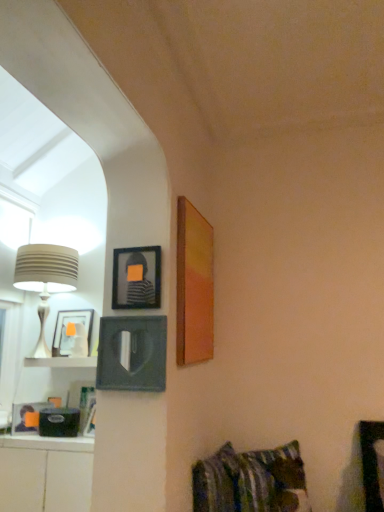
Question: From a real-world perspective, is matte wooden picture frame at upper right, which ranks as the 1th picture frame in right-to-left order, positioned over white glossy cabinet at lower left based on gravity?

Choices:
 (A) no
 (B) yes

Answer: (B)

Question: From a real-world perspective, is matte wooden picture frame at upper right, which is counted as the 3th picture frame, starting from the left, positioned under white glossy cabinet at lower left based on gravity?

Choices:
 (A) no
 (B) yes

Answer: (A)

Question: Does matte wooden picture frame at upper right, which is counted as the 3th picture frame, starting from the left, have a larger size compared to white glossy cabinet at lower left?

Choices:
 (A) no
 (B) yes

Answer: (A)

Question: Is matte wooden picture frame at upper right, which is counted as the 3th picture frame, starting from the left, thinner than white glossy cabinet at lower left?

Choices:
 (A) no
 (B) yes

Answer: (B)

Question: Is the position of matte wooden picture frame at upper right, which is counted as the 3th picture frame, starting from the left, more distant than that of white glossy cabinet at lower left?

Choices:
 (A) yes
 (B) no

Answer: (B)

Question: Is there a large distance between matte wooden picture frame at upper right, which ranks as the 1th picture frame in right-to-left order, and white glossy cabinet at lower left?

Choices:
 (A) yes
 (B) no

Answer: (B)

Question: Is beige ribbed lampshade at left shorter than white glossy cabinet at lower left?

Choices:
 (A) yes
 (B) no

Answer: (B)

Question: Considering the relative sizes of beige ribbed lampshade at left and white glossy cabinet at lower left in the image provided, is beige ribbed lampshade at left bigger than white glossy cabinet at lower left?

Choices:
 (A) yes
 (B) no

Answer: (A)

Question: Is beige ribbed lampshade at left facing towards white glossy cabinet at lower left?

Choices:
 (A) yes
 (B) no

Answer: (B)

Question: From a real-world perspective, is beige ribbed lampshade at left on white glossy cabinet at lower left?

Choices:
 (A) yes
 (B) no

Answer: (A)

Question: Does beige ribbed lampshade at left have a greater height compared to white glossy cabinet at lower left?

Choices:
 (A) no
 (B) yes

Answer: (B)

Question: Does beige ribbed lampshade at left come behind white glossy cabinet at lower left?

Choices:
 (A) yes
 (B) no

Answer: (A)

Question: Does matte black picture frame at left, which appears as the third picture frame when viewed from the right, appear on the left side of white glossy cabinet at lower left?

Choices:
 (A) yes
 (B) no

Answer: (B)